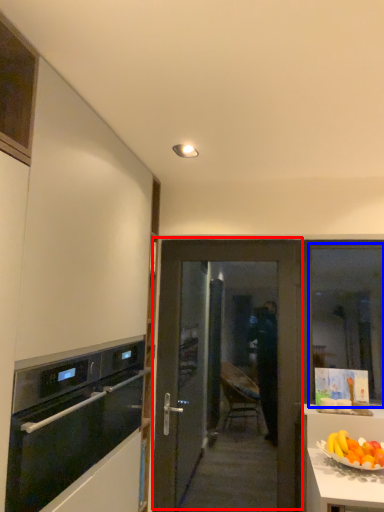
Question: Which of the following is the closest to the observer, door (highlighted by a red box) or window (highlighted by a blue box)?

Choices:
 (A) door
 (B) window

Answer: (A)